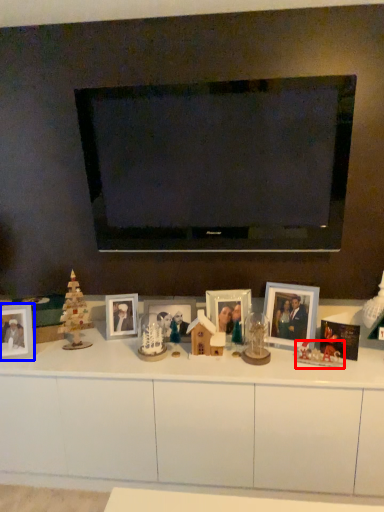
Question: Which object appears closest to the camera in this image, toy (highlighted by a red box) or picture frame (highlighted by a blue box)?

Choices:
 (A) toy
 (B) picture frame

Answer: (A)